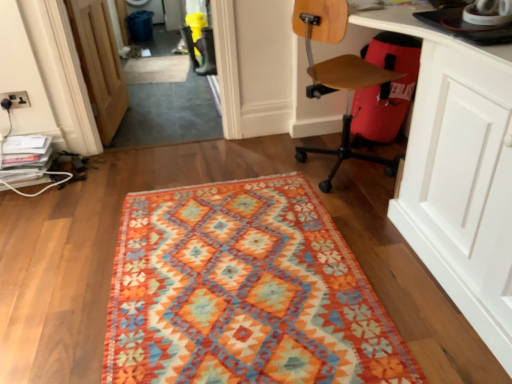
The width and height of the screenshot is (512, 384). Identify the location of vacant space positioned to the left of wooden at right. (x=260, y=155).